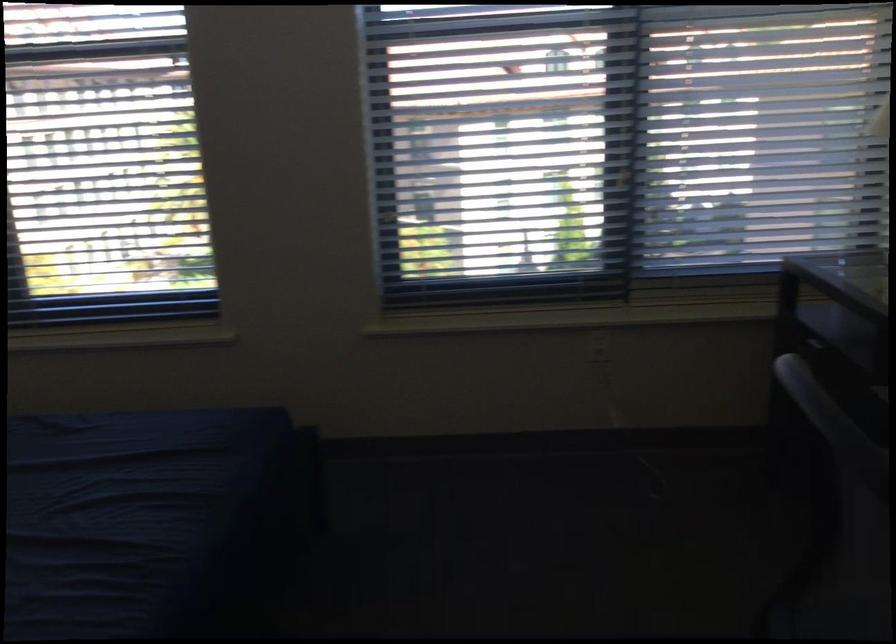
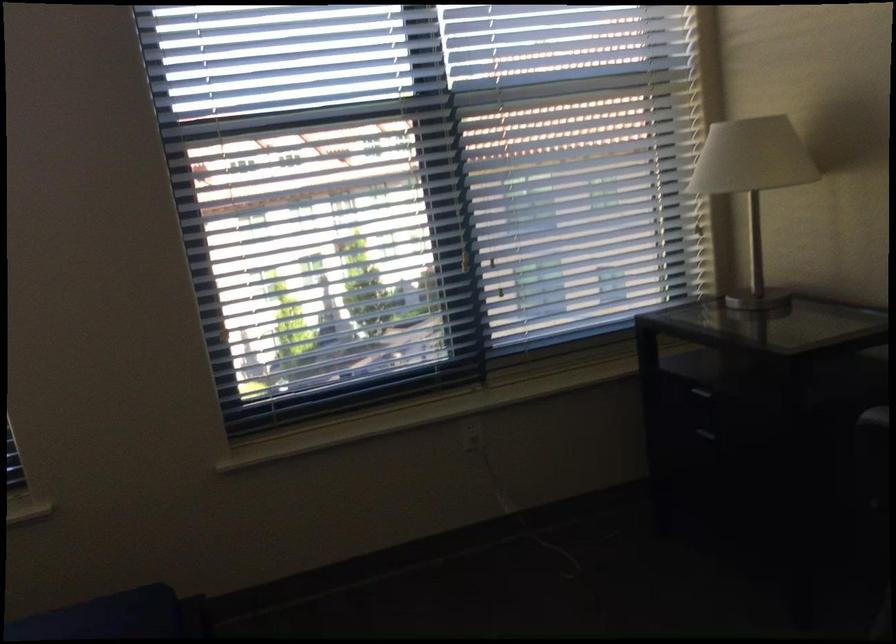
Question: The camera is either moving clockwise (left) or counter-clockwise (right) around the object. The first image is from the beginning of the video and the second image is from the end. Is the camera moving left or right when shooting the video?

Choices:
 (A) Left
 (B) Right

Answer: (A)